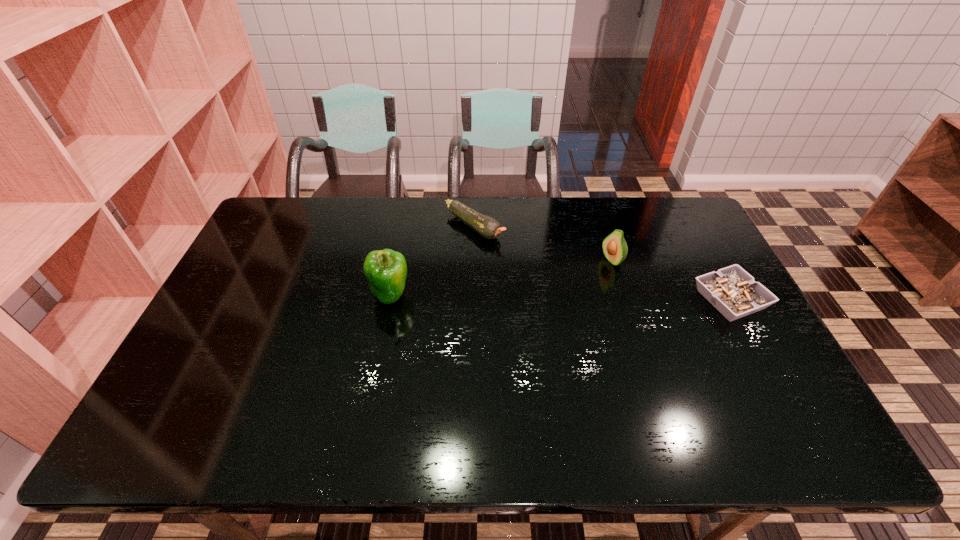
At what (x,y) coordinates should I click in order to perform the action: click on vacant region at the left edge of the desktop. Please return your answer as a coordinate pair (x, y). The height and width of the screenshot is (540, 960). Looking at the image, I should click on (252, 281).

You are a GUI agent. You are given a task and a screenshot of the screen. Output one action in this format:
    pyautogui.click(x=<x>, y=<y>)
    Task: Click on the free space at the right edge of the desktop
    Image resolution: width=960 pixels, height=540 pixels.
    Given the screenshot: What is the action you would take?
    pyautogui.click(x=746, y=350)

In the image, there is a desktop. What are the coordinates of `vacant space at the far left corner` in the screenshot? It's located at (304, 199).

You are a GUI agent. You are given a task and a screenshot of the screen. Output one action in this format:
    pyautogui.click(x=<x>, y=<y>)
    Task: Click on the vacant space at the near right corner
    
    Given the screenshot: What is the action you would take?
    pyautogui.click(x=740, y=384)

Locate an element on the screen. The image size is (960, 540). vacant area that lies between the farthest object and the ashtray is located at coordinates (602, 263).

Image resolution: width=960 pixels, height=540 pixels. In order to click on unoccupied area between the ashtray and the tallest object in this screenshot , I will do `click(560, 298)`.

Locate an element on the screen. The image size is (960, 540). free space between the bell pepper and the ashtray is located at coordinates (560, 298).

Image resolution: width=960 pixels, height=540 pixels. What are the coordinates of `free space between the rightmost object and the second farthest object` in the screenshot? It's located at (671, 280).

At what (x,y) coordinates should I click in order to perform the action: click on vacant space that is in between the zucchini and the rightmost object. Please return your answer as a coordinate pair (x, y). Image resolution: width=960 pixels, height=540 pixels. Looking at the image, I should click on (602, 263).

You are a GUI agent. You are given a task and a screenshot of the screen. Output one action in this format:
    pyautogui.click(x=<x>, y=<y>)
    Task: Click on the free spot between the leftmost object and the rightmost object
    This screenshot has width=960, height=540.
    Given the screenshot: What is the action you would take?
    pyautogui.click(x=560, y=298)